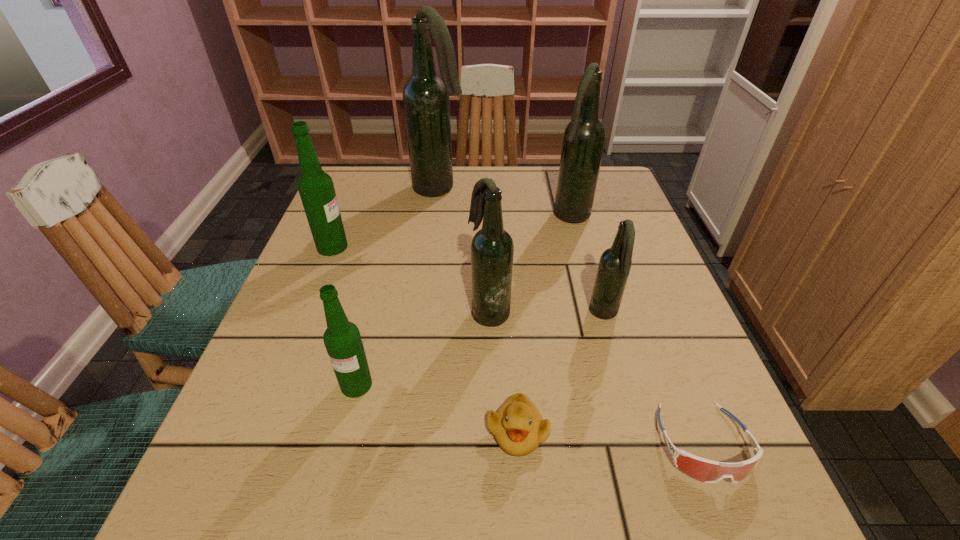
This screenshot has width=960, height=540. In order to click on free space at the far right corner of the desktop in this screenshot , I will do `click(604, 205)`.

The width and height of the screenshot is (960, 540). What are the coordinates of `vacant space that's between the leftmost beer bottle and the red goggles` in the screenshot? It's located at pyautogui.click(x=517, y=345).

At what (x,y) coordinates should I click in order to perform the action: click on free area in between the second biggest dark beer bottle and the seventh tallest object. Please return your answer as a coordinate pair (x, y). Looking at the image, I should click on (544, 324).

At what (x,y) coordinates should I click in order to perform the action: click on empty location between the third farthest object and the goggles. Please return your answer as a coordinate pair (x, y). The height and width of the screenshot is (540, 960). Looking at the image, I should click on (517, 345).

Locate an element on the screen. The height and width of the screenshot is (540, 960). empty space that is in between the third nearest dark beer bottle and the smaller green beer bottle is located at coordinates (464, 301).

Where is `vacant space that is in between the yellow duckling and the third nearest dark beer bottle`? Image resolution: width=960 pixels, height=540 pixels. vacant space that is in between the yellow duckling and the third nearest dark beer bottle is located at coordinates (544, 324).

Locate an element on the screen. vacant space in between the smallest dark beer bottle and the seventh tallest object is located at coordinates (561, 373).

The image size is (960, 540). In order to click on free space between the second tallest beer bottle and the yellow duckling in this screenshot , I will do `click(544, 324)`.

Identify the location of free space between the third dark beer bottle from right to left and the goggles. (596, 377).

You are a GUI agent. You are given a task and a screenshot of the screen. Output one action in this format:
    pyautogui.click(x=<x>, y=<y>)
    Task: Click on the object that stands as the fourth closest to the tallest beer bottle
    The height and width of the screenshot is (540, 960).
    Given the screenshot: What is the action you would take?
    pyautogui.click(x=615, y=263)